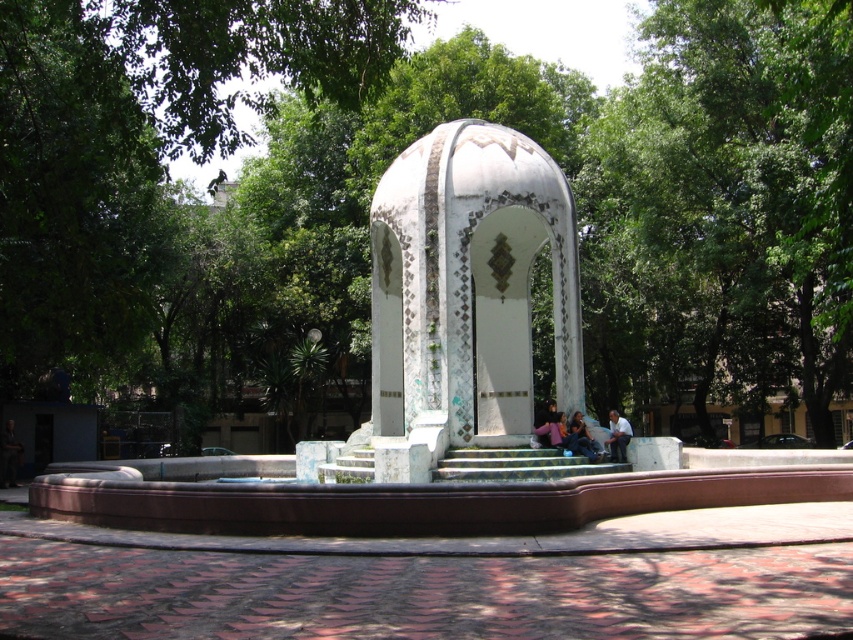
Where is `blue denim jeans at lower center`? blue denim jeans at lower center is located at coordinates (583, 438).

Is blue denim jeans at lower center in front of blue denim jeans at center?

Yes, blue denim jeans at lower center is closer to the viewer.

Does point (592, 449) come in front of point (555, 436)?

Yes, point (592, 449) is in front of point (555, 436).

The width and height of the screenshot is (853, 640). Identify the location of blue denim jeans at lower center. (583, 438).

Does point (743, 166) come in front of point (552, 216)?

No, it is not.

Is green leafy tree at upper center wider than white mosaic gazebo at center?

Indeed, green leafy tree at upper center has a greater width compared to white mosaic gazebo at center.

Is point (660, 253) closer to camera compared to point (486, 330)?

No, it is behind (486, 330).

At what (x,y) coordinates should I click in order to perform the action: click on green leafy tree at upper center. Please return your answer as a coordinate pair (x, y). Looking at the image, I should click on (724, 212).

Can you confirm if green leafy tree at center is positioned above light blue stone bench at center?

Yes, green leafy tree at center is above light blue stone bench at center.

Which is more to the left, green leafy tree at center or light blue stone bench at center?

green leafy tree at center

Does point (144, 20) come closer to viewer compared to point (608, 410)?

Yes.

The image size is (853, 640). In order to click on green leafy tree at center in this screenshot , I will do `click(370, 202)`.